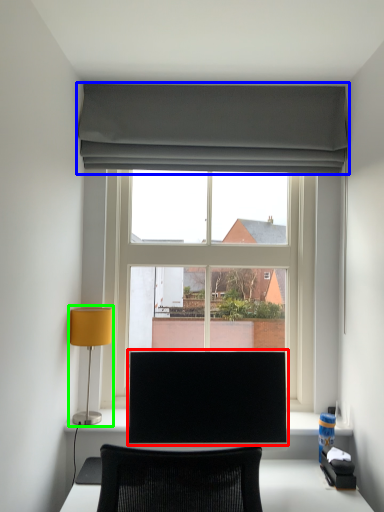
Question: Estimate the real-world distances between objects in this image. Which object is farther from computer monitor (highlighted by a red box), curtain (highlighted by a blue box) or table lamp (highlighted by a green box)?

Choices:
 (A) curtain
 (B) table lamp

Answer: (A)